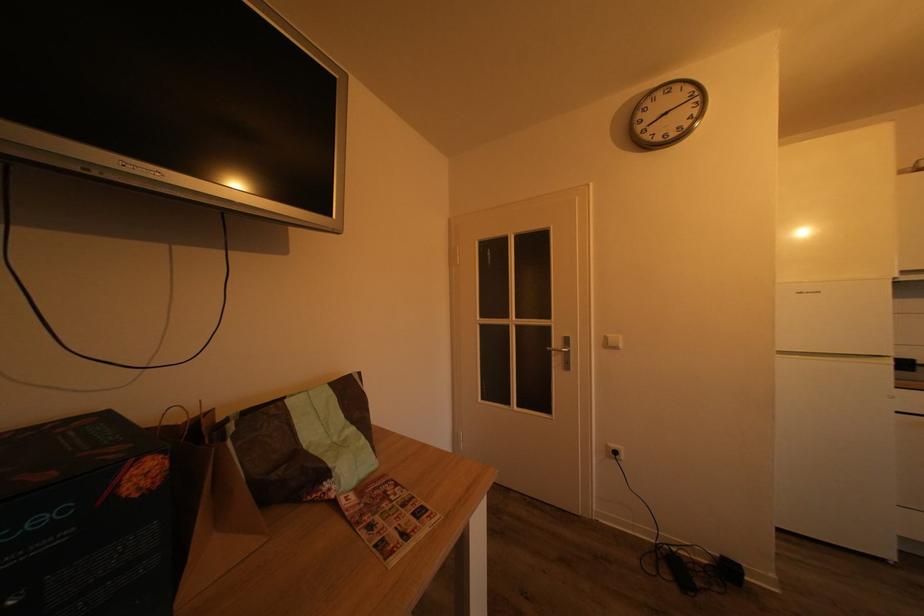
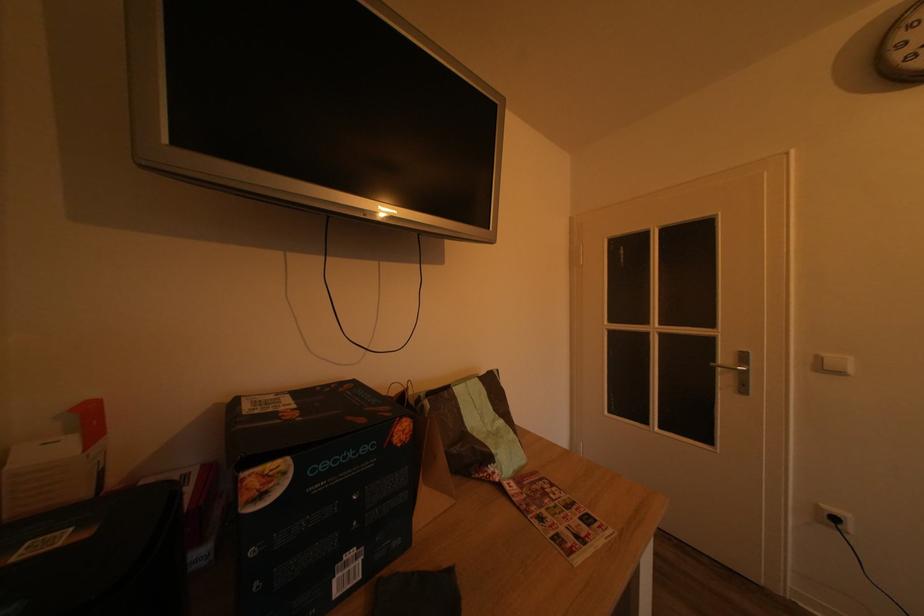
The point at (154, 464) is marked in the first image. Where is the corresponding point in the second image?

(411, 426)